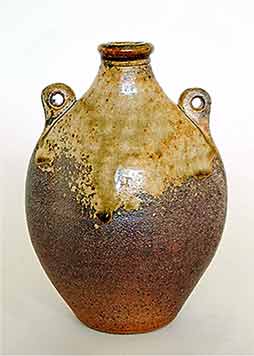
The image size is (254, 356). What are the coordinates of `vase` in the screenshot? It's located at (183, 235).